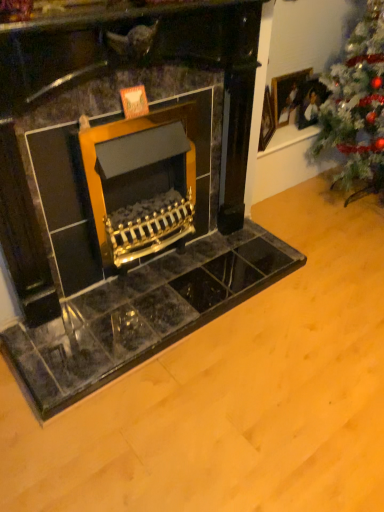
The width and height of the screenshot is (384, 512). Describe the element at coordinates (288, 95) in the screenshot. I see `wooden picture frame at upper right` at that location.

Locate an element on the screen. This screenshot has width=384, height=512. wooden picture frame at upper right is located at coordinates (288, 95).

Where is `green textured christmas tree at right`? The image size is (384, 512). green textured christmas tree at right is located at coordinates (357, 106).

The width and height of the screenshot is (384, 512). What do you see at coordinates (357, 106) in the screenshot?
I see `green textured christmas tree at right` at bounding box center [357, 106].

Image resolution: width=384 pixels, height=512 pixels. In order to click on wooden picture frame at upper right in this screenshot , I will do `click(288, 95)`.

Considering the positions of objects green textured christmas tree at right and wooden picture frame at upper right in the image provided, who is more to the right, green textured christmas tree at right or wooden picture frame at upper right?

Positioned to the right is green textured christmas tree at right.

Is green textured christmas tree at right in front of wooden picture frame at upper right?

Yes.

Considering the positions of points (327, 75) and (288, 100), is point (327, 75) farther from camera compared to point (288, 100)?

That is False.

From the image's perspective, would you say green textured christmas tree at right is shown under wooden picture frame at upper right?

Indeed, from the image's perspective, green textured christmas tree at right is shown beneath wooden picture frame at upper right.

From a real-world perspective, relative to wooden picture frame at upper right, is green textured christmas tree at right vertically above or below?

Clearly, from a real-world perspective, green textured christmas tree at right is above wooden picture frame at upper right.

Is green textured christmas tree at right thinner than wooden picture frame at upper right?

In fact, green textured christmas tree at right might be wider than wooden picture frame at upper right.

Considering the relative sizes of green textured christmas tree at right and wooden picture frame at upper right in the image provided, is green textured christmas tree at right taller than wooden picture frame at upper right?

Yes.

Considering the sizes of green textured christmas tree at right and wooden picture frame at upper right in the image, is green textured christmas tree at right bigger or smaller than wooden picture frame at upper right?

green textured christmas tree at right is bigger than wooden picture frame at upper right.

Could wooden picture frame at upper right be considered to be inside green textured christmas tree at right?

Definitely not — wooden picture frame at upper right is not inside green textured christmas tree at right.

From the picture: Would you consider green textured christmas tree at right to be distant from wooden picture frame at upper right?

No, there isn't a large distance between green textured christmas tree at right and wooden picture frame at upper right.

Is green textured christmas tree at right facing towards wooden picture frame at upper right?

No, green textured christmas tree at right is not facing towards wooden picture frame at upper right.

In the scene shown: What's the angular difference between green textured christmas tree at right and wooden picture frame at upper right's facing directions?

There is a 89.4-degree angle between the facing directions of green textured christmas tree at right and wooden picture frame at upper right.

The image size is (384, 512). In order to click on christmas tree in front of the wooden picture frame at upper right in this screenshot , I will do `click(357, 106)`.

Which is more to the left, wooden picture frame at upper right or green textured christmas tree at right?

From the viewer's perspective, wooden picture frame at upper right appears more on the left side.

Considering the positions of objects wooden picture frame at upper right and green textured christmas tree at right in the image provided, who is in front, wooden picture frame at upper right or green textured christmas tree at right?

green textured christmas tree at right is closer to the camera.

Considering the points (298, 73) and (383, 81), which point is in front, point (298, 73) or point (383, 81)?

The point (383, 81) is more forward.

Consider the image. From the image's perspective, is wooden picture frame at upper right above or below green textured christmas tree at right?

Clearly, from the image's perspective, wooden picture frame at upper right is above green textured christmas tree at right.

From a real-world perspective, which is physically above, wooden picture frame at upper right or green textured christmas tree at right?

green textured christmas tree at right, from a real-world perspective.

Considering the relative sizes of wooden picture frame at upper right and green textured christmas tree at right in the image provided, is wooden picture frame at upper right thinner than green textured christmas tree at right?

Yes, wooden picture frame at upper right is thinner than green textured christmas tree at right.

Who is taller, wooden picture frame at upper right or green textured christmas tree at right?

With more height is green textured christmas tree at right.

Between wooden picture frame at upper right and green textured christmas tree at right, which one has smaller size?

wooden picture frame at upper right.

Do you think wooden picture frame at upper right is within green textured christmas tree at right, or outside of it?

wooden picture frame at upper right is spatially situated outside green textured christmas tree at right.

Is wooden picture frame at upper right touching green textured christmas tree at right?

No, wooden picture frame at upper right is not in contact with green textured christmas tree at right.

Does wooden picture frame at upper right turn towards green textured christmas tree at right?

Yes, wooden picture frame at upper right is facing green textured christmas tree at right.

Where is `picture frame that is above the green textured christmas tree at right (from the image's perspective)`? picture frame that is above the green textured christmas tree at right (from the image's perspective) is located at coordinates (288, 95).

Where is `christmas tree lying in front of the wooden picture frame at upper right`? This screenshot has height=512, width=384. christmas tree lying in front of the wooden picture frame at upper right is located at coordinates (357, 106).

Find the location of a particular element. This screenshot has height=512, width=384. picture frame lying behind the green textured christmas tree at right is located at coordinates (288, 95).